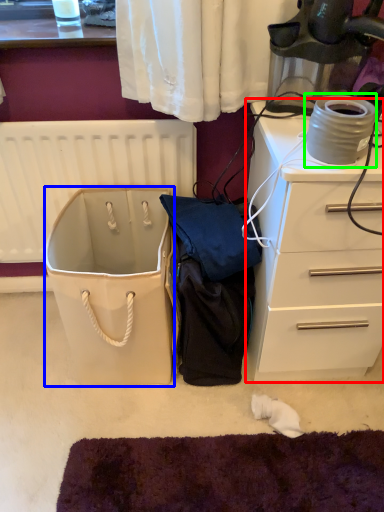
Question: Which object is positioned closest to chest of drawers (highlighted by a red box)? Select from wide (highlighted by a blue box) and appliance (highlighted by a green box).

Choices:
 (A) wide
 (B) appliance

Answer: (B)